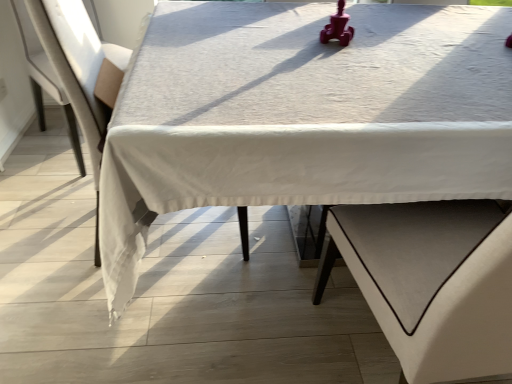
In order to click on free space in front of white fabric armchair at left in this screenshot , I will do coord(106,309).